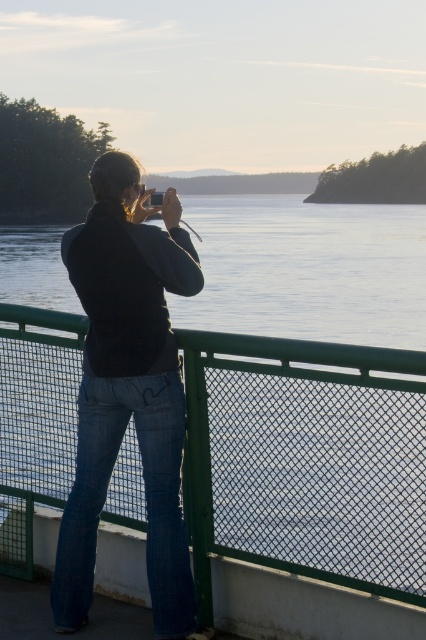
Is green mesh fence at center shorter than denim jeans at center?

Indeed, green mesh fence at center has a lesser height compared to denim jeans at center.

How much distance is there between green mesh fence at center and denim jeans at center?

green mesh fence at center and denim jeans at center are 21.50 inches apart from each other.

Image resolution: width=426 pixels, height=640 pixels. What do you see at coordinates (305, 460) in the screenshot? I see `green mesh fence at center` at bounding box center [305, 460].

The width and height of the screenshot is (426, 640). In order to click on green mesh fence at center in this screenshot , I will do `click(305, 460)`.